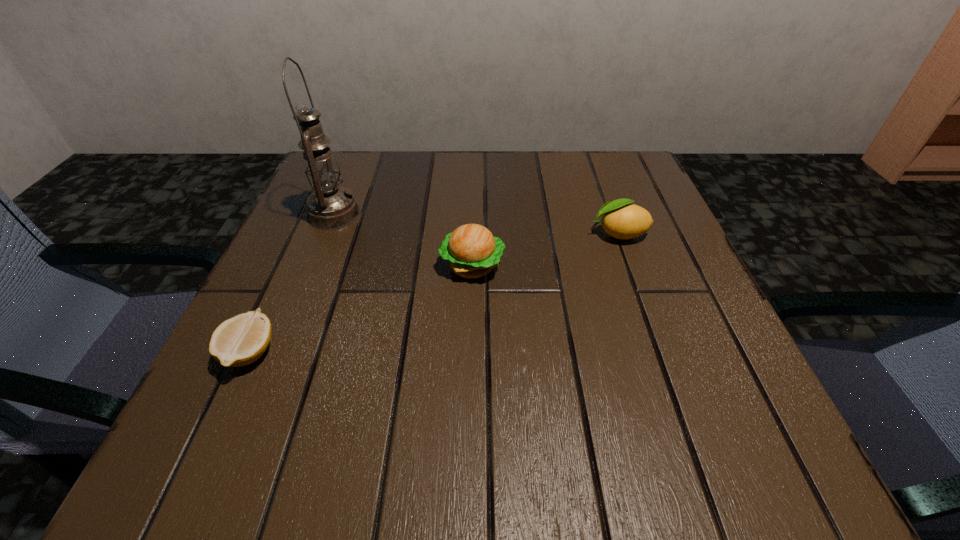
This screenshot has width=960, height=540. In order to click on free location located with leaves positioned above the rightmost object in this screenshot , I will do `click(428, 234)`.

Find the location of `free region located 0.110m with leaves positioned above the rightmost object`. free region located 0.110m with leaves positioned above the rightmost object is located at coordinates (534, 234).

Identify the location of free space located 0.240m on the right of the nearer lemon. (434, 353).

Find the location of `object positioned at the far edge`. object positioned at the far edge is located at coordinates (330, 206).

Where is `oil lamp at the left edge`? The image size is (960, 540). oil lamp at the left edge is located at coordinates (330, 206).

I want to click on lemon located in the left edge section of the desktop, so click(241, 340).

The width and height of the screenshot is (960, 540). Find the location of `object at the right edge`. object at the right edge is located at coordinates (621, 220).

At what (x,y) coordinates should I click in order to perform the action: click on object that is at the far left corner. Please return your answer as a coordinate pair (x, y). Looking at the image, I should click on (330, 206).

The width and height of the screenshot is (960, 540). In order to click on free region at the far edge of the desktop in this screenshot , I will do `click(487, 166)`.

You are a GUI agent. You are given a task and a screenshot of the screen. Output one action in this format:
    pyautogui.click(x=<x>, y=<y>)
    Task: Click on the free point at the near edge
    This screenshot has height=540, width=960.
    Given the screenshot: What is the action you would take?
    pyautogui.click(x=591, y=465)